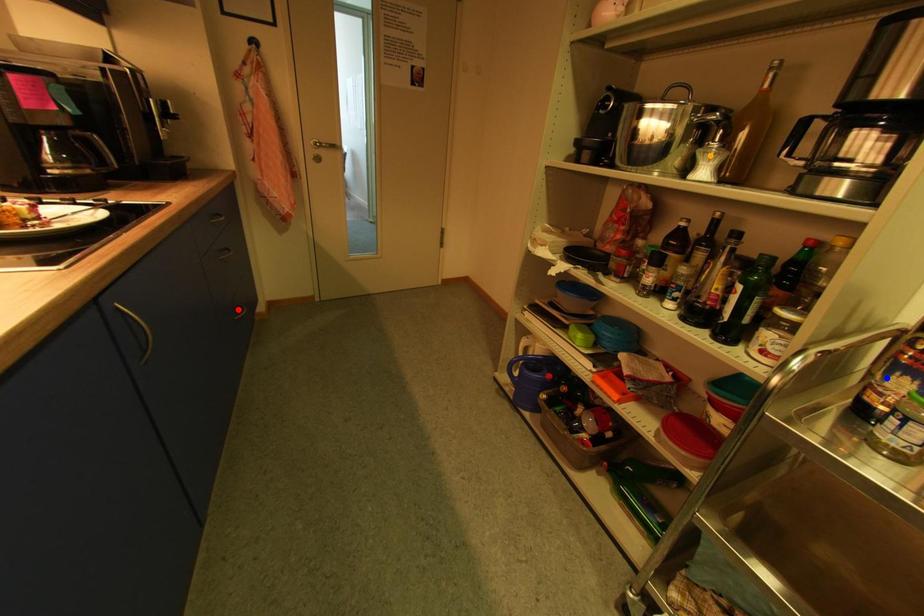
Order these from nearest to farthest:
orange point, blue point, red point

blue point, orange point, red point